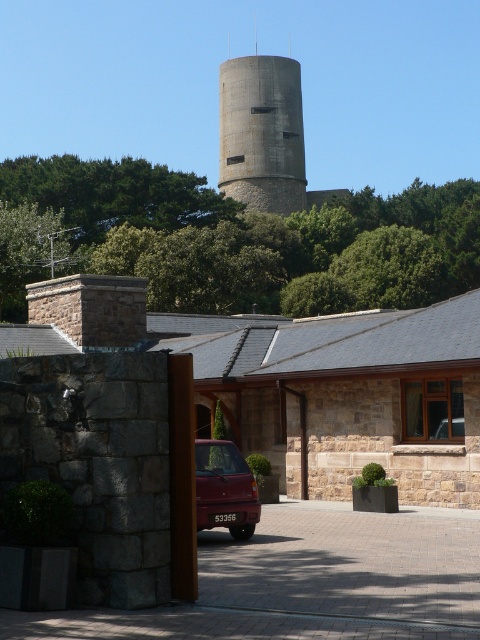
Can you confirm if concrete water tower at center is bigger than shiny maroon sedan at center?

Yes, concrete water tower at center is bigger than shiny maroon sedan at center.

Is concrete water tower at center smaller than shiny maroon sedan at center?

No.

Is point (229, 115) less distant than point (225, 465)?

No, it is behind (225, 465).

This screenshot has height=640, width=480. Identify the location of concrete water tower at center. (262, 132).

Can you confirm if paved brick driveway at center is positioned to the left of concrete water tower at center?

No, paved brick driveway at center is not to the left of concrete water tower at center.

Can you confirm if paved brick driveway at center is positioned below concrete water tower at center?

Yes.

Find the location of a particular element. Image resolution: width=480 pixels, height=640 pixels. paved brick driveway at center is located at coordinates (348, 564).

I want to click on paved brick driveway at center, so click(x=348, y=564).

Does paved brick driveway at center lie in front of shiny maroon sedan at center?

Yes, paved brick driveway at center is in front of shiny maroon sedan at center.

Is paved brick driveway at center smaller than shiny maroon sedan at center?

No.

Identify the location of paved brick driveway at center. (348, 564).